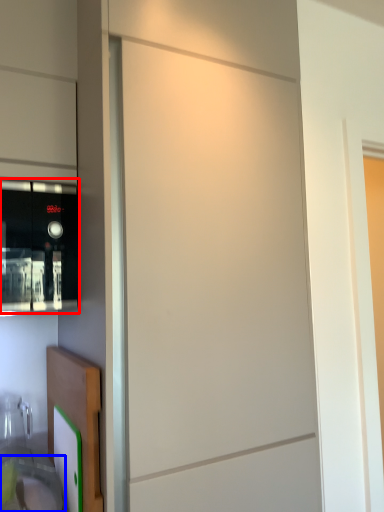
Question: Among these objects, which one is farthest to the camera, home appliance (highlighted by a red box) or sink (highlighted by a blue box)?

Choices:
 (A) home appliance
 (B) sink

Answer: (A)